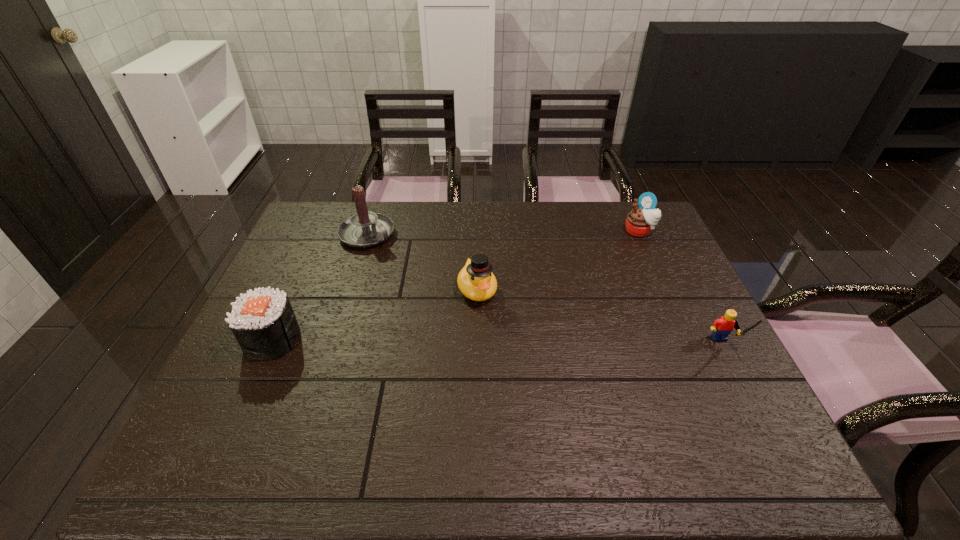
In the image, there is a desktop. Identify the location of vacant space at the near right corner. This screenshot has height=540, width=960. (757, 410).

This screenshot has width=960, height=540. In order to click on unoccupied area between the sushi and the muffin in this screenshot , I will do `click(456, 285)`.

Where is `free space between the third farthest object and the candle`? The height and width of the screenshot is (540, 960). free space between the third farthest object and the candle is located at coordinates (422, 262).

At what (x,y) coordinates should I click in order to perform the action: click on vacant space that is in between the sushi and the third farthest object. Please return your answer as a coordinate pair (x, y). This screenshot has height=540, width=960. Looking at the image, I should click on (374, 314).

You are a GUI agent. You are given a task and a screenshot of the screen. Output one action in this format:
    pyautogui.click(x=<x>, y=<y>)
    Task: Click on the unoccupied position between the tallest object and the Lego
    
    Given the screenshot: What is the action you would take?
    pyautogui.click(x=545, y=290)

Find the location of a particular element. empty space that is in between the candle and the Lego is located at coordinates (545, 290).

Find the location of a particular element. The width and height of the screenshot is (960, 540). free space between the Lego and the candle is located at coordinates (545, 290).

This screenshot has width=960, height=540. Identify the location of free spot between the Lego and the candle. click(x=545, y=290).

The height and width of the screenshot is (540, 960). What are the coordinates of `free spot between the third farthest object and the tallest object` in the screenshot? It's located at (422, 262).

At what (x,y) coordinates should I click in order to perform the action: click on free space between the sushi and the muffin. Please return your answer as a coordinate pair (x, y). This screenshot has height=540, width=960. Looking at the image, I should click on (456, 285).